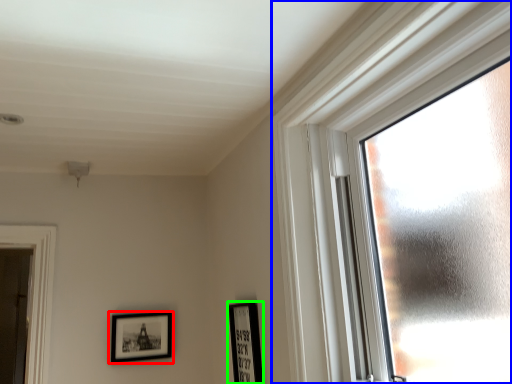
Question: Which object is positioned closest to picture frame (highlighted by a red box)? Select from window (highlighted by a blue box) and picture frame (highlighted by a green box).

Choices:
 (A) window
 (B) picture frame

Answer: (B)